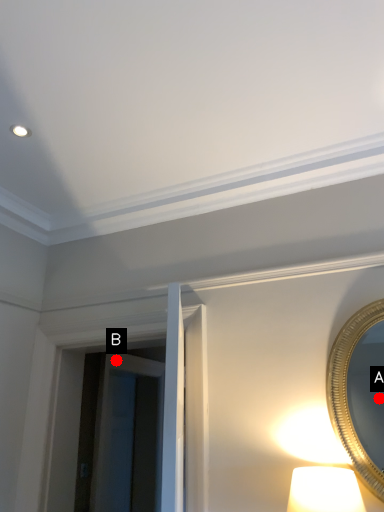
Question: Two points are circled on the image, labeled by A and B beside each circle. Which of the following is the closest to the observer?

Choices:
 (A) A is closer
 (B) B is closer

Answer: (A)